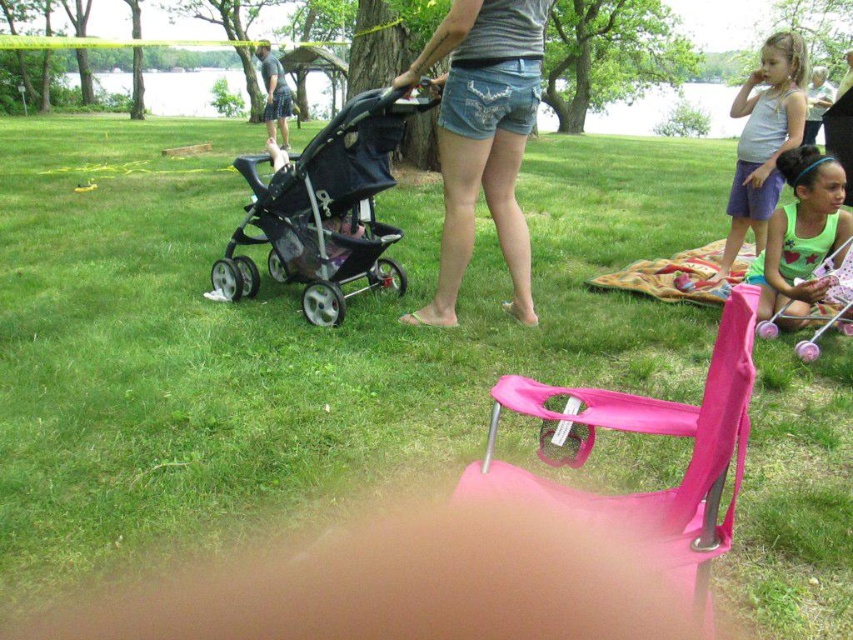
Question: Which point is farther to the camera?

Choices:
 (A) matte white tank top at upper right
 (B) multicolored woven blanket at lower right
 (C) black mesh stroller at center

Answer: (A)

Question: Does pink fabric folding chair at lower right have a smaller size compared to matte white tank top at upper right?

Choices:
 (A) no
 (B) yes

Answer: (A)

Question: Which point appears farthest from the camera in this image?

Choices:
 (A) (503, 214)
 (B) (277, 248)

Answer: (B)

Question: Among these points, which one is farthest from the camera?

Choices:
 (A) [515, 304]
 (B) [347, 128]
 (C) [761, 93]

Answer: (C)

Question: Is the position of pink fabric folding chair at lower right less distant than that of denim shorts at center?

Choices:
 (A) yes
 (B) no

Answer: (A)

Question: Observing the image, what is the correct spatial positioning of pink fabric folding chair at lower right in reference to matte white tank top at upper right?

Choices:
 (A) left
 (B) right

Answer: (A)